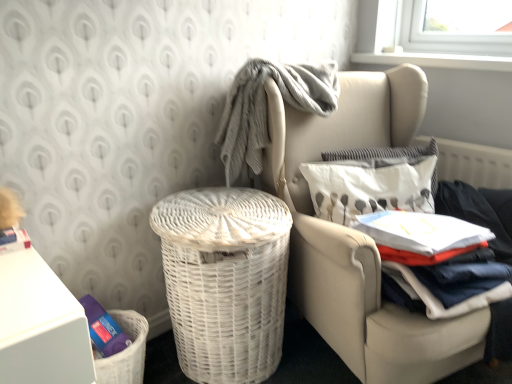
Question: Can you confirm if gray textured blanket at upper center is wider than white wicker chair at center?

Choices:
 (A) no
 (B) yes

Answer: (A)

Question: Can you confirm if gray textured blanket at upper center is bigger than white wicker chair at center?

Choices:
 (A) yes
 (B) no

Answer: (B)

Question: Is gray textured blanket at upper center next to white wicker chair at center?

Choices:
 (A) yes
 (B) no

Answer: (B)

Question: Does gray textured blanket at upper center have a smaller size compared to white wicker chair at center?

Choices:
 (A) no
 (B) yes

Answer: (B)

Question: Is gray textured blanket at upper center taller than white wicker chair at center?

Choices:
 (A) yes
 (B) no

Answer: (B)

Question: From a real-world perspective, does gray textured blanket at upper center stand above white wicker chair at center?

Choices:
 (A) yes
 (B) no

Answer: (A)

Question: From the image's perspective, is white textured pillow at upper right, the 2th pillow in the back-to-front sequence, under white wicker basket at center-left?

Choices:
 (A) yes
 (B) no

Answer: (B)

Question: Considering the relative sizes of white textured pillow at upper right, the 2th pillow in the back-to-front sequence, and white wicker basket at center-left in the image provided, is white textured pillow at upper right, the 2th pillow in the back-to-front sequence, smaller than white wicker basket at center-left?

Choices:
 (A) yes
 (B) no

Answer: (A)

Question: Is white textured pillow at upper right, which is the first pillow in front-to-back order, with white wicker basket at center-left?

Choices:
 (A) yes
 (B) no

Answer: (B)

Question: Is there a large distance between white textured pillow at upper right, which is the first pillow in front-to-back order, and white wicker basket at center-left?

Choices:
 (A) no
 (B) yes

Answer: (A)

Question: Is white textured pillow at upper right, the 2th pillow in the back-to-front sequence, behind white wicker basket at center-left?

Choices:
 (A) yes
 (B) no

Answer: (A)

Question: From a real-world perspective, is white textured pillow at upper right, which is the first pillow in front-to-back order, beneath white wicker basket at center-left?

Choices:
 (A) no
 (B) yes

Answer: (A)

Question: Does white cotton shirt at right appear on the right side of white wicker basket at center-left?

Choices:
 (A) no
 (B) yes

Answer: (B)